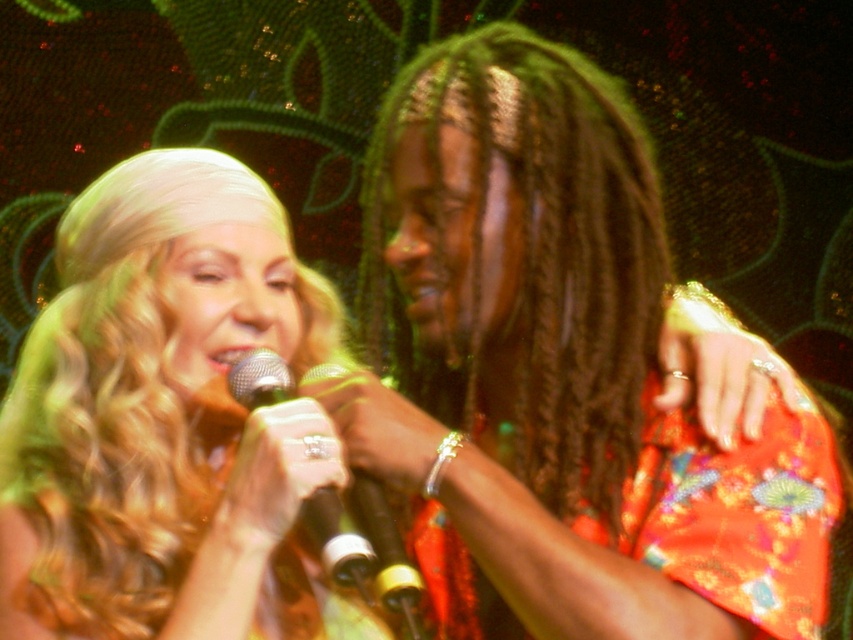
Question: Is shiny orange dress at center bigger than black metallic microphone at center?

Choices:
 (A) no
 (B) yes

Answer: (B)

Question: Estimate the real-world distances between objects in this image. Which object is farther from the dark brown braided hair at center?

Choices:
 (A) blonde hair at center
 (B) shiny orange dress at center
 (C) metallic silver microphone at center

Answer: (C)

Question: Considering the relative positions of shiny orange dress at center and black metallic microphone at center in the image provided, where is shiny orange dress at center located with respect to black metallic microphone at center?

Choices:
 (A) right
 (B) left

Answer: (A)

Question: Among these objects, which one is nearest to the camera?

Choices:
 (A) blonde hair at center
 (B) metallic silver microphone at center
 (C) dark brown braided hair at center

Answer: (B)

Question: Can you confirm if dark brown braided hair at center is wider than black metallic microphone at center?

Choices:
 (A) yes
 (B) no

Answer: (A)

Question: Which object is positioned closest to the dark brown braided hair at center?

Choices:
 (A) black metallic microphone at center
 (B) shiny orange dress at center
 (C) blonde hair at center
 (D) metallic silver microphone at center

Answer: (B)